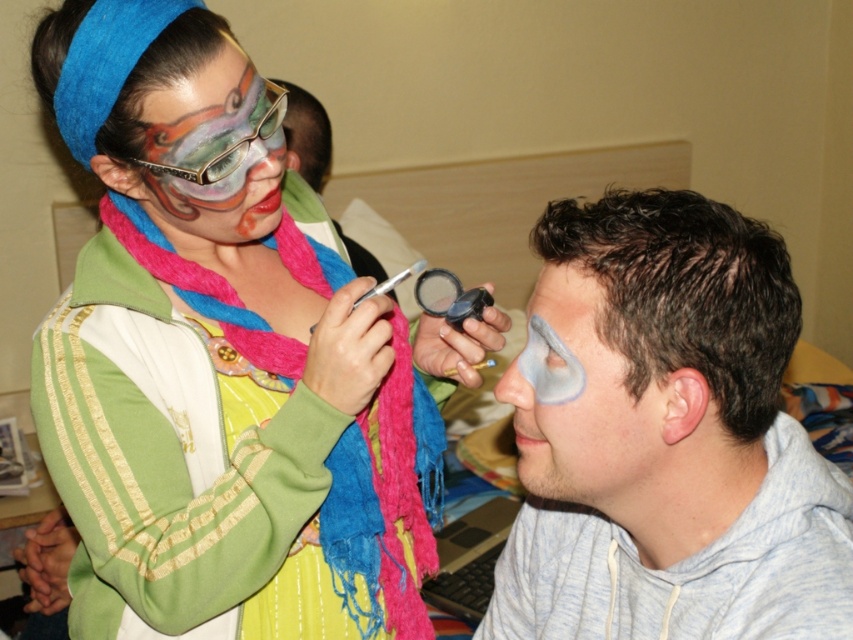
Can you confirm if matte multicolored scarf at upper left is shorter than transparent plastic magnifying glass at upper center?

No.

Is matte multicolored scarf at upper left below transparent plastic magnifying glass at upper center?

Correct, matte multicolored scarf at upper left is located below transparent plastic magnifying glass at upper center.

This screenshot has height=640, width=853. Identify the location of matte multicolored scarf at upper left. (233, 353).

Which is above, multicolored painted face at upper left or matte black face paint at upper center?

matte black face paint at upper center

Is multicolored painted face at upper left above matte black face paint at upper center?

Incorrect, multicolored painted face at upper left is not positioned above matte black face paint at upper center.

You are a GUI agent. You are given a task and a screenshot of the screen. Output one action in this format:
    pyautogui.click(x=<x>, y=<y>)
    Task: Click on the multicolored painted face at upper left
    
    Given the screenshot: What is the action you would take?
    pyautogui.click(x=213, y=150)

The image size is (853, 640). I want to click on multicolored painted face at upper left, so click(x=213, y=150).

Between point (590, 387) and point (479, 307), which one is positioned behind?

Point (479, 307)

Which is more to the right, matte blue paint at right or transparent plastic magnifying glass at upper center?

Positioned to the right is matte blue paint at right.

The width and height of the screenshot is (853, 640). Describe the element at coordinates (582, 403) in the screenshot. I see `matte blue paint at right` at that location.

Where is `matte blue paint at right`? matte blue paint at right is located at coordinates (582, 403).